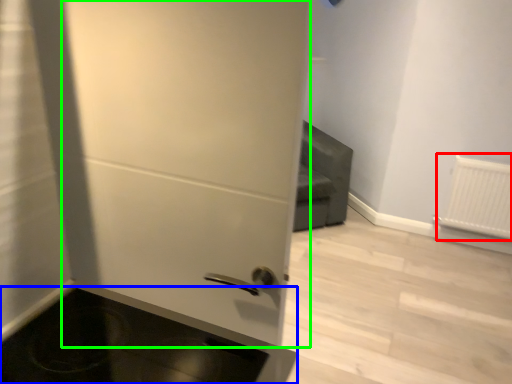
Question: Which object is the farthest from radiator (highlighted by a red box)? Choose among these: appliance (highlighted by a blue box) or door (highlighted by a green box).

Choices:
 (A) appliance
 (B) door

Answer: (A)